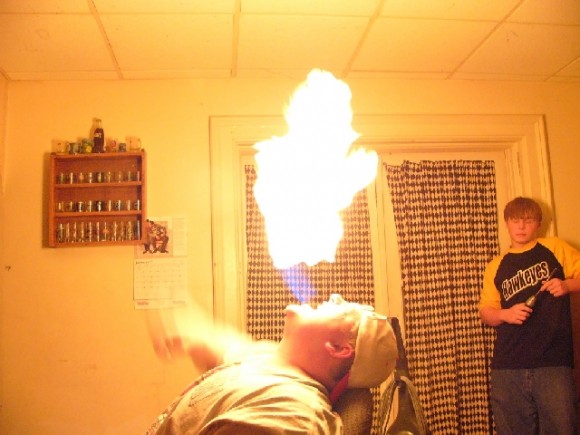
Locate an element on the screen. calendar is located at coordinates [x=159, y=262].